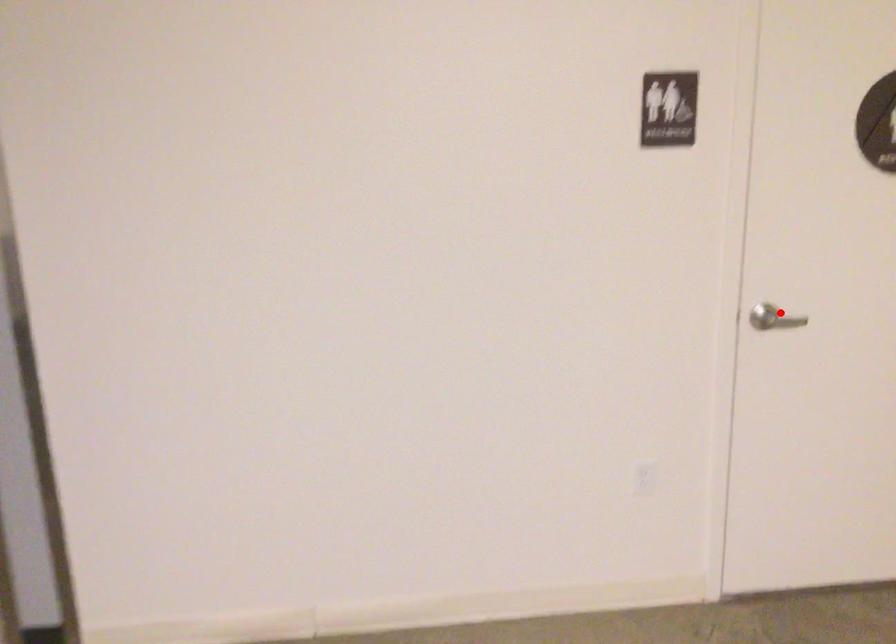
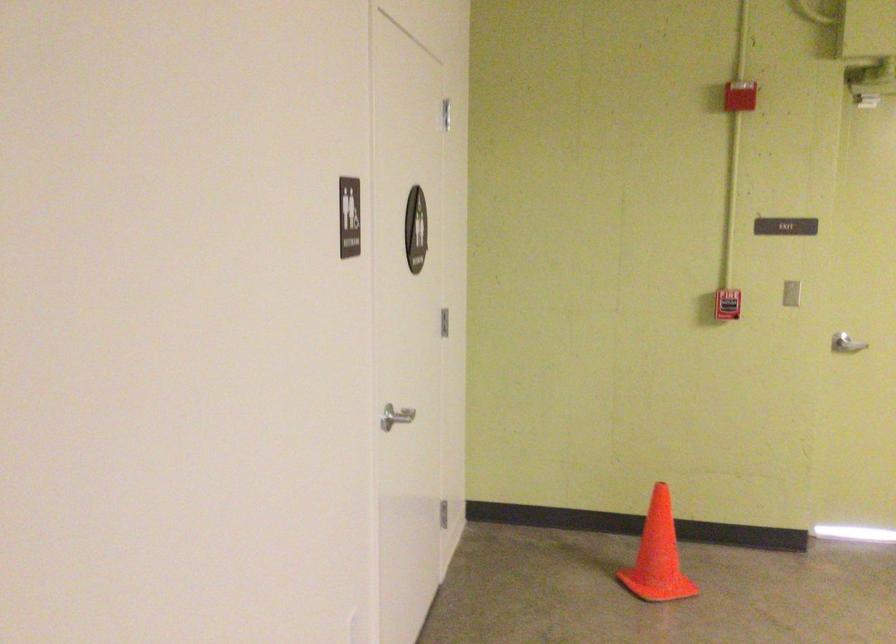
Locate, in the second image, the point that corresponds to the highlighted location in the first image.

(394, 415)